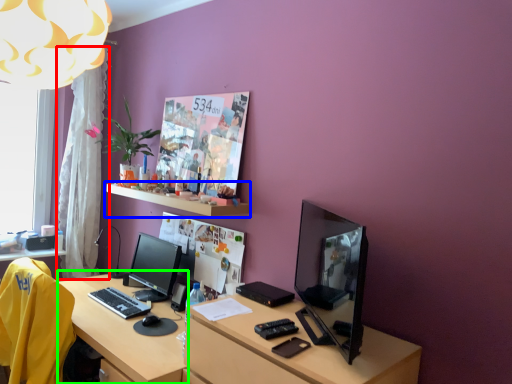
Question: Estimate the real-world distances between objects in this image. Which object is closer to curtain (highlighted by a red box), shelf (highlighted by a blue box) or vanity (highlighted by a green box)?

Choices:
 (A) shelf
 (B) vanity

Answer: (A)